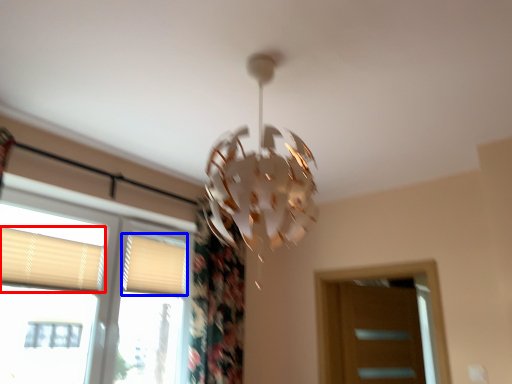
Question: Which of the following is the closest to the observer, shutter (highlighted by a red box) or shutter (highlighted by a blue box)?

Choices:
 (A) shutter
 (B) shutter

Answer: (A)